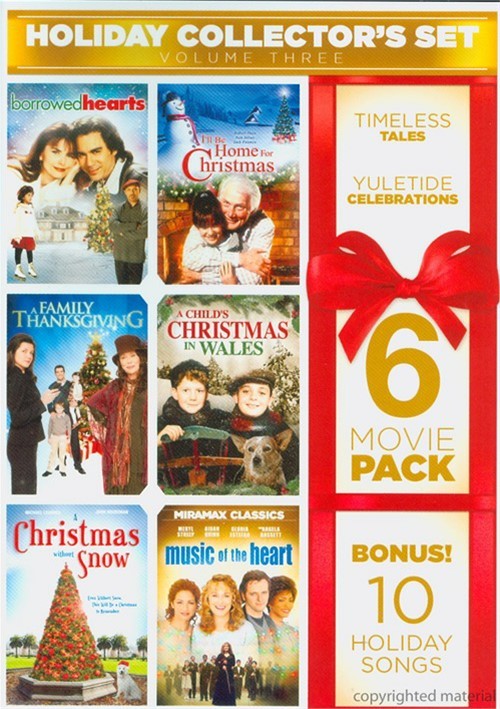
Identify the location of christmas tree. (74, 642), (287, 381), (97, 361), (289, 128), (105, 201).